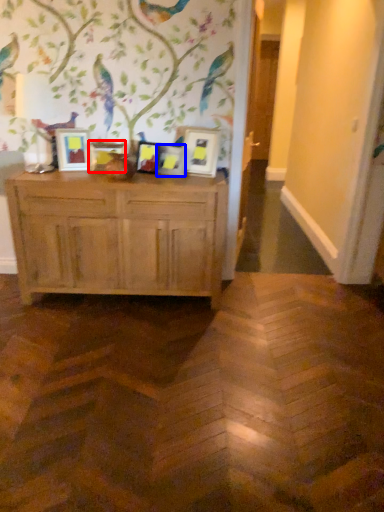
Question: Which point is closer to the camera, picture frame (highlighted by a red box) or picture frame (highlighted by a blue box)?

Choices:
 (A) picture frame
 (B) picture frame

Answer: (B)